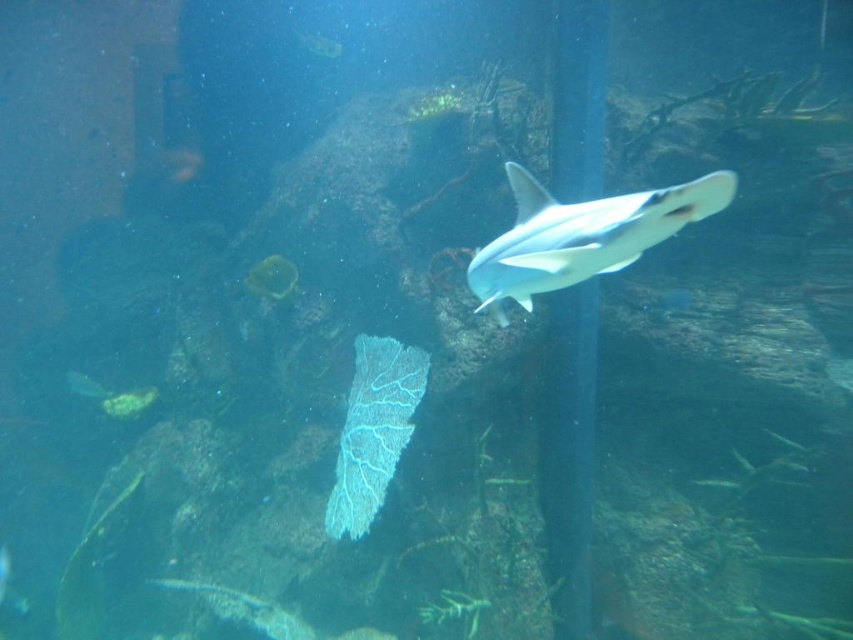
Can you confirm if translucent white shark at center is taller than white matte shark at center?

Indeed, translucent white shark at center has a greater height compared to white matte shark at center.

Is point (77, 381) positioned in front of point (708, 480)?

No, it is behind (708, 480).

Identify the location of translucent white shark at center. (85, 385).

Does white smooth shark at center appear on the right side of translucent white shark at center?

Correct, you'll find white smooth shark at center to the right of translucent white shark at center.

Is white smooth shark at center to the left of translucent white shark at center from the viewer's perspective?

In fact, white smooth shark at center is to the right of translucent white shark at center.

Which is in front, point (635, 198) or point (74, 376)?

Point (635, 198)

I want to click on white smooth shark at center, so click(x=582, y=236).

Does white smooth shark at center have a greater width compared to white matte shark at center?

Yes, white smooth shark at center is wider than white matte shark at center.

How distant is white smooth shark at center from white matte shark at center?

white smooth shark at center and white matte shark at center are 2.05 meters apart.

Image resolution: width=853 pixels, height=640 pixels. I want to click on white smooth shark at center, so click(x=582, y=236).